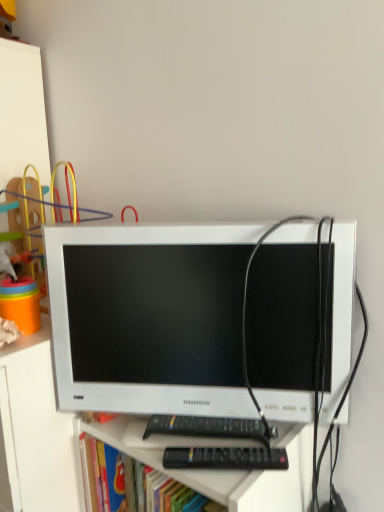
Question: Does black plastic remote at lower center have a greater width compared to white glossy computer monitor at center?

Choices:
 (A) no
 (B) yes

Answer: (A)

Question: Considering the relative sizes of black plastic remote at lower center and white glossy computer monitor at center in the image provided, is black plastic remote at lower center taller than white glossy computer monitor at center?

Choices:
 (A) no
 (B) yes

Answer: (A)

Question: Is black plastic remote at lower center further to the viewer compared to white glossy computer monitor at center?

Choices:
 (A) yes
 (B) no

Answer: (A)

Question: From a real-world perspective, is black plastic remote at lower center below white glossy computer monitor at center?

Choices:
 (A) no
 (B) yes

Answer: (B)

Question: Considering the relative sizes of black plastic remote at lower center and white glossy computer monitor at center in the image provided, is black plastic remote at lower center shorter than white glossy computer monitor at center?

Choices:
 (A) no
 (B) yes

Answer: (B)

Question: From a real-world perspective, relative to black plastic remote at lower center, is white matte file cabinet at left vertically above or below?

Choices:
 (A) below
 (B) above

Answer: (A)

Question: From their relative heights in the image, would you say white matte file cabinet at left is taller or shorter than black plastic remote at lower center?

Choices:
 (A) short
 (B) tall

Answer: (B)

Question: Visually, is white matte file cabinet at left positioned to the left or to the right of black plastic remote at lower center?

Choices:
 (A) right
 (B) left

Answer: (B)

Question: Is white matte file cabinet at left bigger or smaller than black plastic remote at lower center?

Choices:
 (A) small
 (B) big

Answer: (B)

Question: Is plastic rainbow rings at left wider or thinner than black plastic remote at lower center?

Choices:
 (A) wide
 (B) thin

Answer: (A)

Question: In terms of size, does plastic rainbow rings at left appear bigger or smaller than black plastic remote at lower center?

Choices:
 (A) big
 (B) small

Answer: (A)

Question: From a real-world perspective, is plastic rainbow rings at left positioned above or below black plastic remote at lower center?

Choices:
 (A) above
 (B) below

Answer: (A)

Question: Is plastic rainbow rings at left taller or shorter than black plastic remote at lower center?

Choices:
 (A) tall
 (B) short

Answer: (A)

Question: Is white glossy computer monitor at center bigger or smaller than plastic rainbow rings at left?

Choices:
 (A) small
 (B) big

Answer: (A)

Question: Considering the positions of white glossy computer monitor at center and plastic rainbow rings at left in the image, is white glossy computer monitor at center wider or thinner than plastic rainbow rings at left?

Choices:
 (A) thin
 (B) wide

Answer: (A)